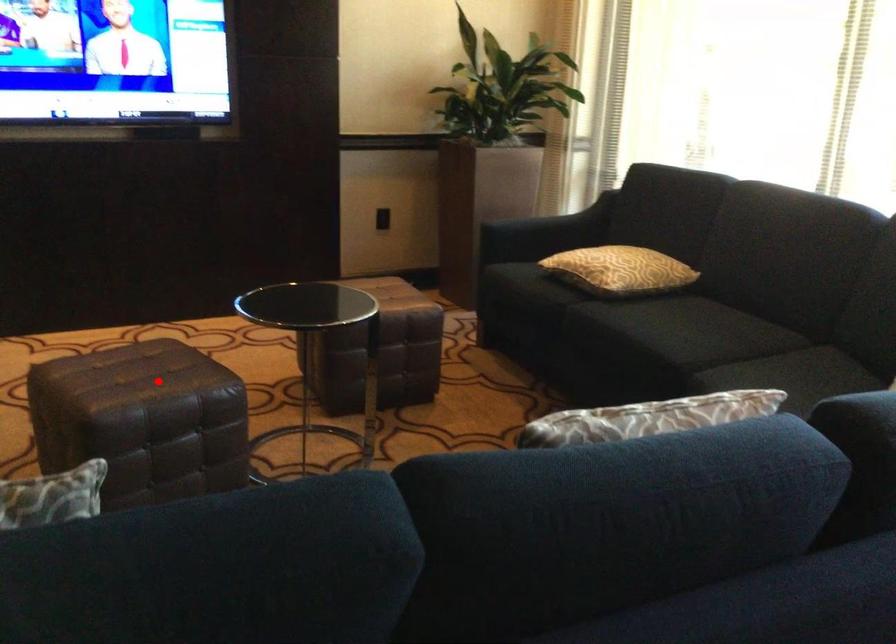
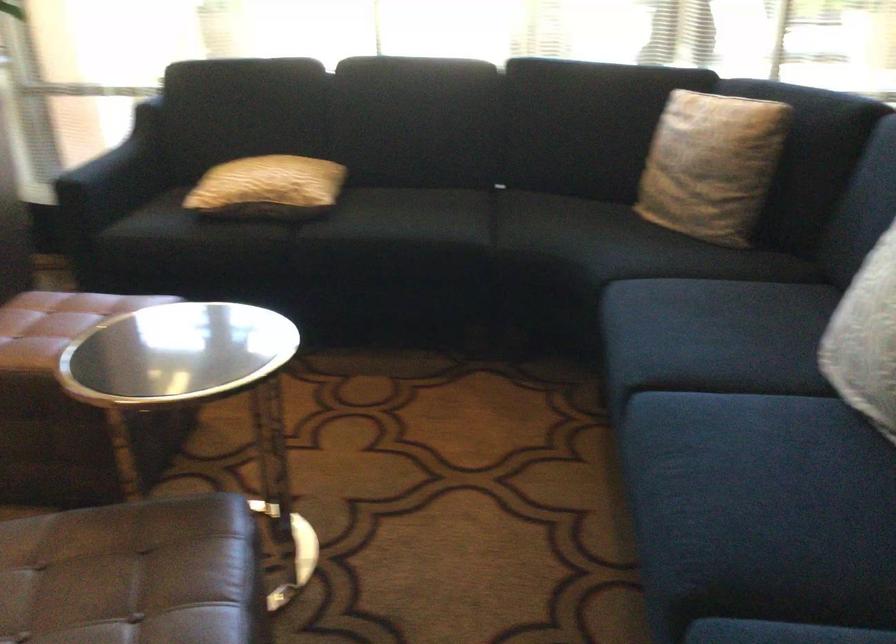
In the second image, find the point that corresponds to the highlighted location in the first image.

(134, 574)